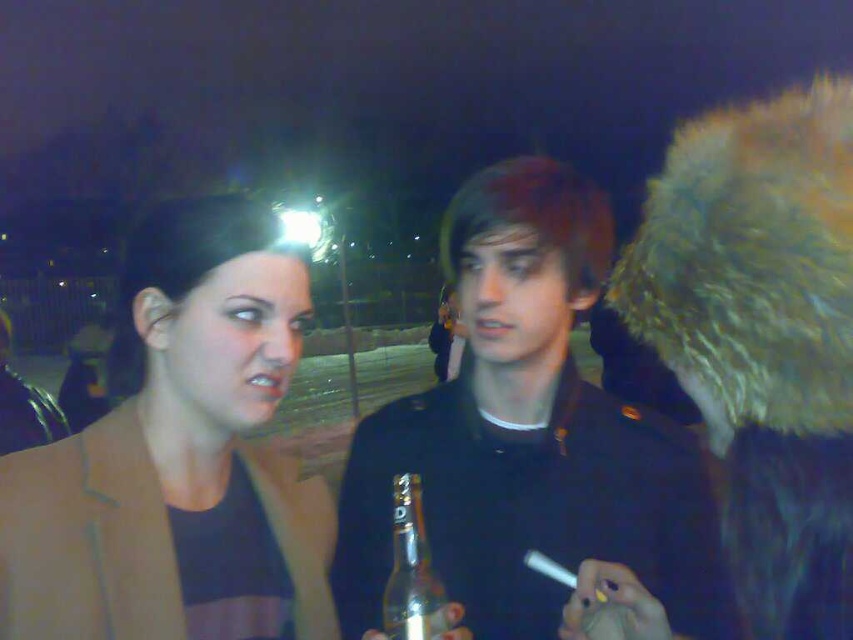
Question: Which point is farther from the camera taking this photo?

Choices:
 (A) (3, 492)
 (B) (529, 225)

Answer: (B)

Question: Which point appears closest to the camera in this image?

Choices:
 (A) (463, 595)
 (B) (125, 605)
 (C) (436, 604)

Answer: (B)

Question: Which of the following is the farthest from the observer?

Choices:
 (A) coord(619,582)
 (B) coord(297,516)
 (C) coord(415,536)

Answer: (B)

Question: Is shiny black jacket at center positioned in front of clear glass bottle at center?

Choices:
 (A) yes
 (B) no

Answer: (B)

Question: Is shiny black jacket at center wider than brown leather jacket at left?

Choices:
 (A) yes
 (B) no

Answer: (A)

Question: Is brown leather jacket at left smaller than clear glass bottle at center?

Choices:
 (A) yes
 (B) no

Answer: (B)